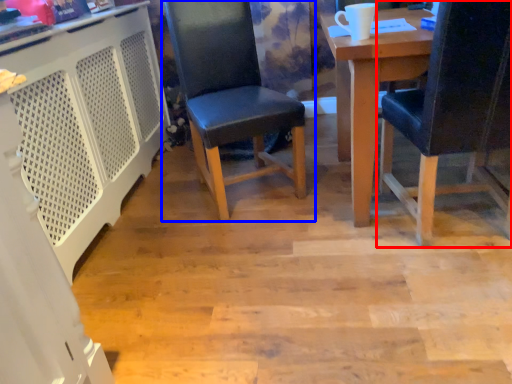
Question: Which of the following is the closest to the observer, chair (highlighted by a red box) or chair (highlighted by a blue box)?

Choices:
 (A) chair
 (B) chair

Answer: (A)